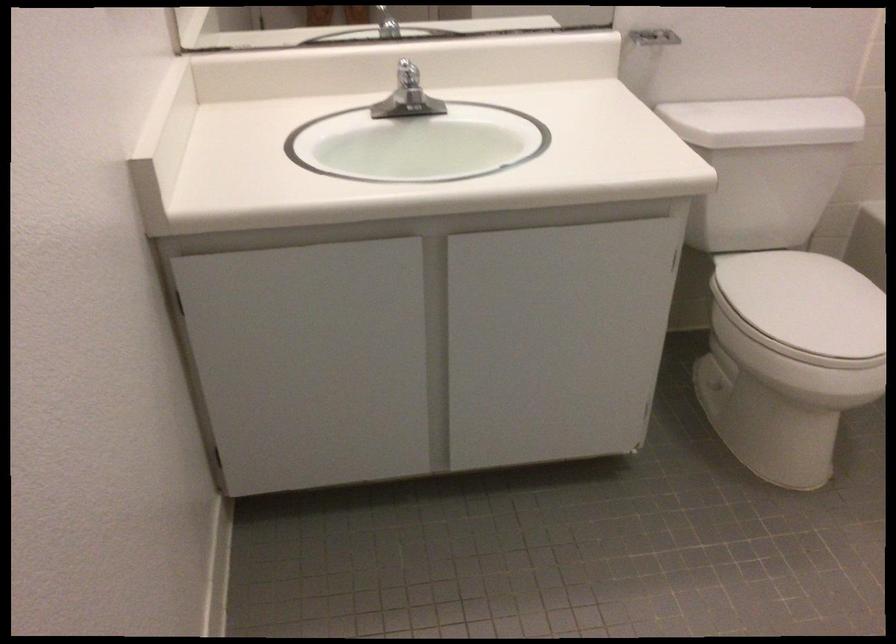
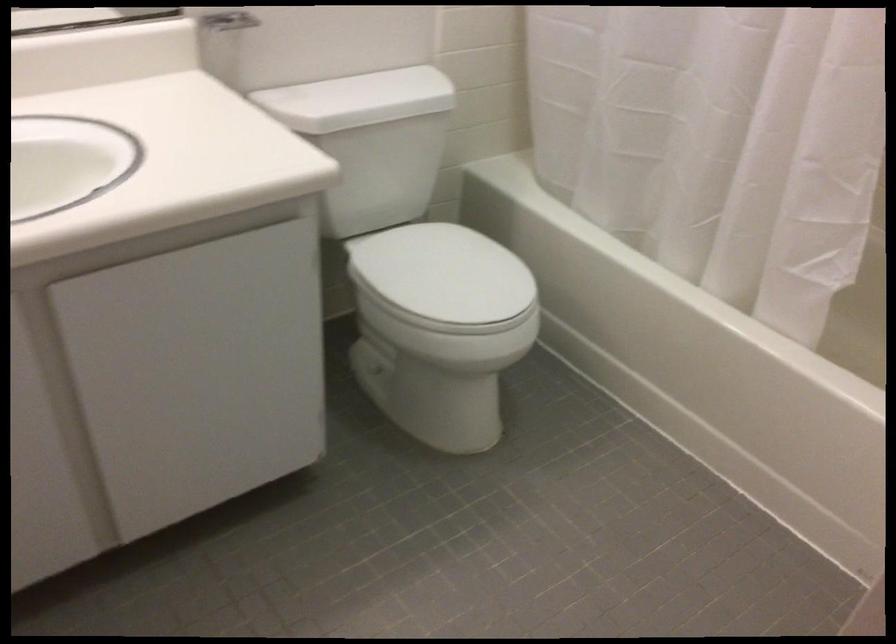
Question: The camera is either moving clockwise (left) or counter-clockwise (right) around the object. The first image is from the beginning of the video and the second image is from the end. Is the camera moving left or right when shooting the video?

Choices:
 (A) Left
 (B) Right

Answer: (A)